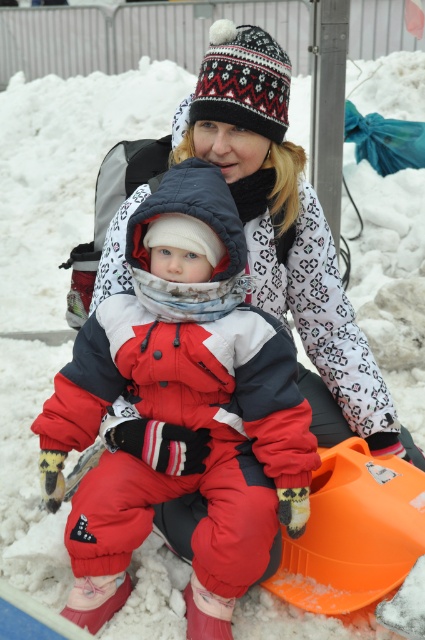
Locate an element on the screen. red fleece snowsuit at center is located at coordinates (181, 410).

Does red fleece snowsuit at center have a lesser width compared to white knit hat at upper center?

Yes, red fleece snowsuit at center is thinner than white knit hat at upper center.

Does point (129, 561) come in front of point (195, 108)?

No, it is behind (195, 108).

At what (x,y) coordinates should I click in order to perform the action: click on red fleece snowsuit at center. Please return your answer as a coordinate pair (x, y). This screenshot has height=640, width=425. Looking at the image, I should click on (181, 410).